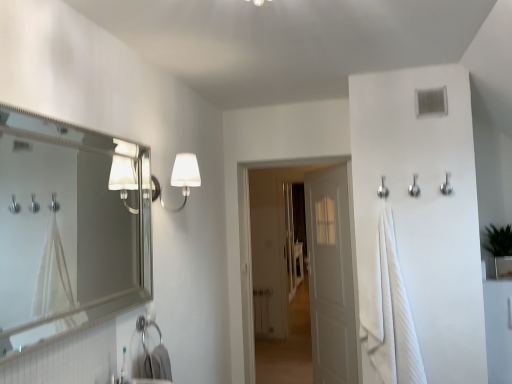
Question: From their relative heights in the image, would you say silver metallic hook at upper right, the first shower viewed from the right, is taller or shorter than white fabric lampshade at upper center?

Choices:
 (A) tall
 (B) short

Answer: (B)

Question: Is silver metallic hook at upper right, the first shower viewed from the right, wider or thinner than white fabric lampshade at upper center?

Choices:
 (A) thin
 (B) wide

Answer: (A)

Question: Estimate the real-world distances between objects in this image. Which object is farther from the silver metallic hook at upper right, acting as the 3th shower starting from the left?

Choices:
 (A) white plastic toothbrush at lower left
 (B) white fabric lampshade at upper center
 (C) white plastic vent at upper right
 (D) white wooden door at center, the 1th door in the front-to-back sequence
 (E) white matte door at center, positioned as the first door in back-to-front order

Answer: (D)

Question: Estimate the real-world distances between objects in this image. Which object is closer to the white plastic toothbrush at lower left?

Choices:
 (A) white fabric lampshade at upper center
 (B) white cotton bath towel at right
 (C) silver/metallic mirror at left
 (D) silver metallic hook at upper right, acting as the 3th shower starting from the left
 (E) white wooden door at center, the 1th door in the front-to-back sequence

Answer: (A)